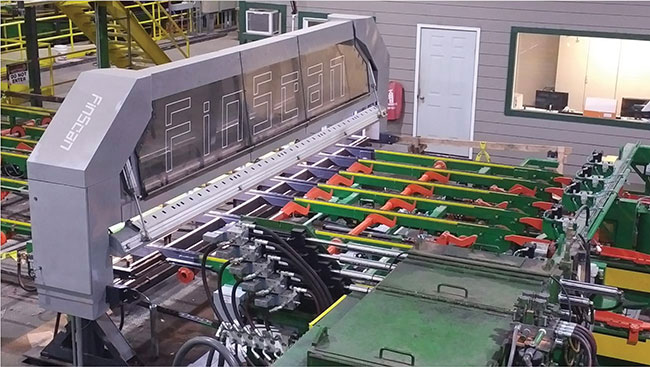
The width and height of the screenshot is (650, 367). What are the coordinates of `right side of door frame` in the screenshot? It's located at [x=473, y=92].